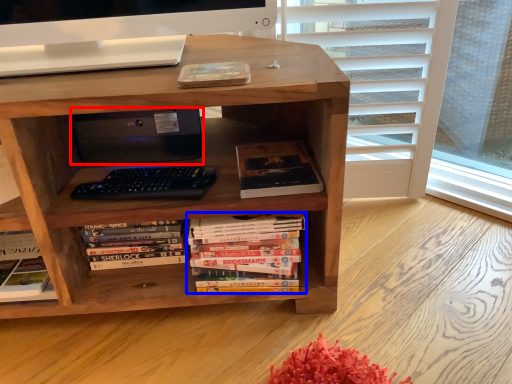
Question: Which object appears closest to the camera in this image, computer (highlighted by a red box) or book (highlighted by a blue box)?

Choices:
 (A) computer
 (B) book

Answer: (B)